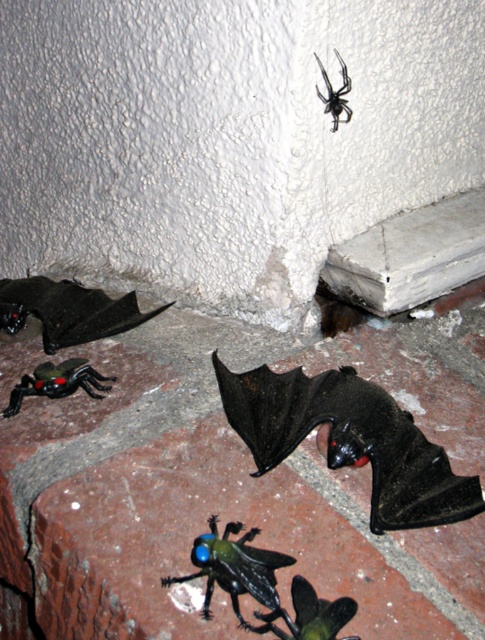
You are a child trying to place both the black matte bat at lower center and the black matte spider at upper center on a shelf. Which object should you place first if you want to ensure the wider object is on the left side of the shelf?

The black matte bat at lower center might be wider than the black matte spider at upper center, so you should place the black matte bat at lower center first on the left side to accommodate its width.

What is the object located at the coordinate point (237, 570) in the image?

The object located at the coordinate point (237, 570) is the translucent blue green insect at lower center.